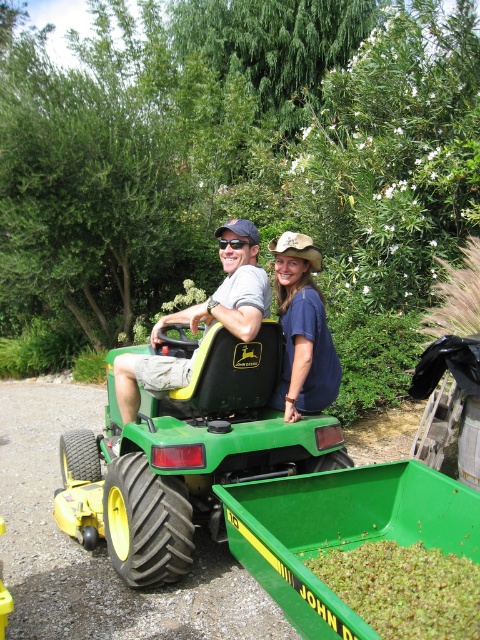
Question: Which object is closer to the camera taking this photo?

Choices:
 (A) matte black tractor at center
 (B) green rubber lawn mower at center

Answer: (B)

Question: Among these points, which one is nearest to the camera?

Choices:
 (A) (247, 316)
 (B) (285, 385)
 (C) (245, 456)

Answer: (A)

Question: Does green rubber lawn mower at center appear on the right side of matte black tractor at center?

Choices:
 (A) no
 (B) yes

Answer: (A)

Question: Which point appears closest to the camera in this image?

Choices:
 (A) (217, 324)
 (B) (311, 284)
 (C) (254, 236)

Answer: (A)

Question: Considering the relative positions of matte black tractor at center and blue cotton shirt at center in the image provided, where is matte black tractor at center located with respect to blue cotton shirt at center?

Choices:
 (A) left
 (B) right

Answer: (A)

Question: From the image, what is the correct spatial relationship of matte black tractor at center in relation to blue cotton shirt at center?

Choices:
 (A) left
 (B) right

Answer: (A)